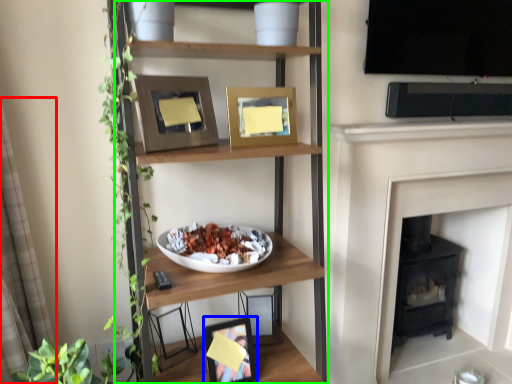
Question: Considering the real-world distances, which object is farthest from curtain (highlighted by a red box)? picture frame (highlighted by a blue box) or shelf (highlighted by a green box)?

Choices:
 (A) picture frame
 (B) shelf

Answer: (A)